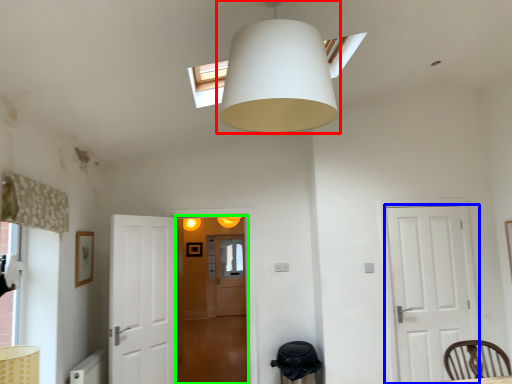
Question: Which object is positioned farthest from lamp (highlighted by a red box)? Select from door (highlighted by a blue box) and glass door (highlighted by a green box).

Choices:
 (A) door
 (B) glass door

Answer: (B)